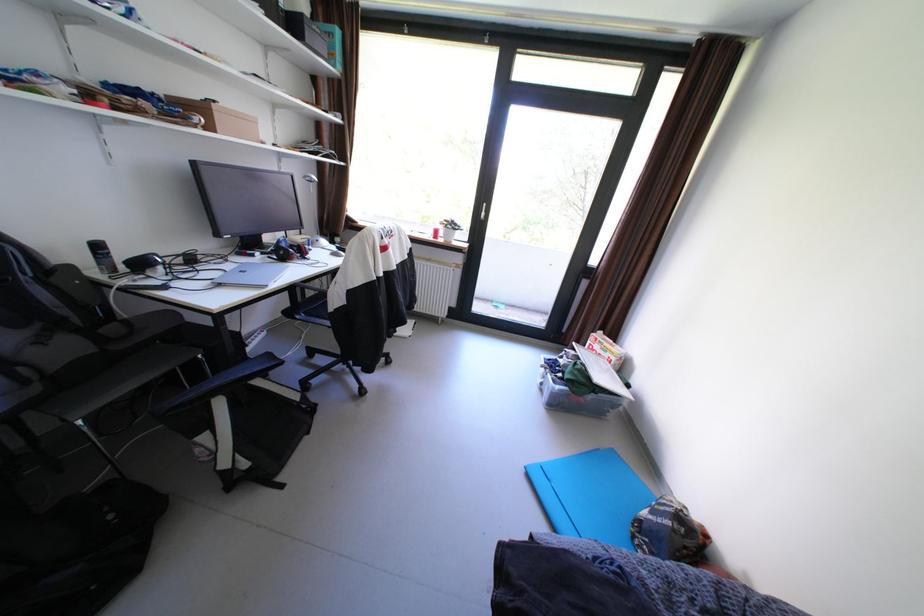
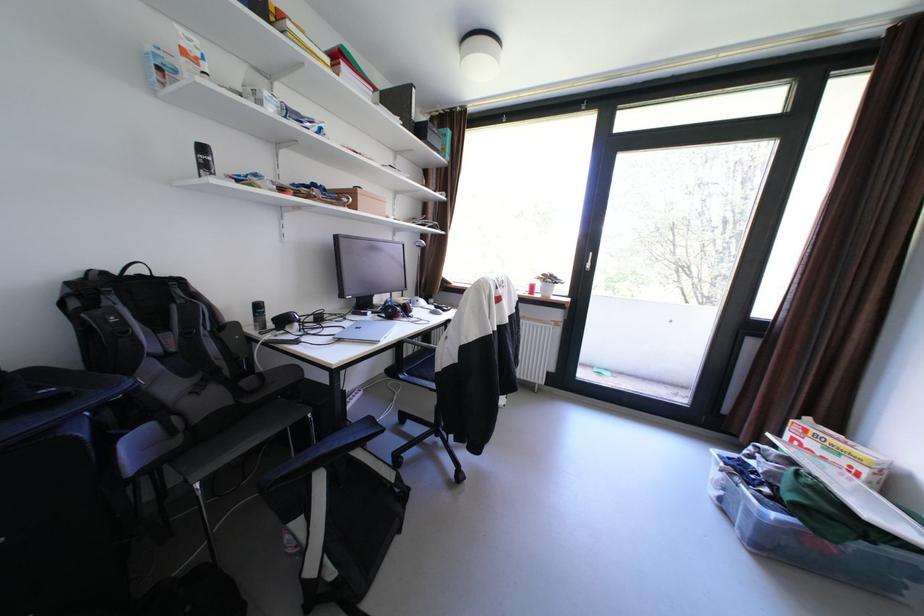
The point at (259, 373) is marked in the first image. Where is the corresponding point in the second image?

(361, 440)